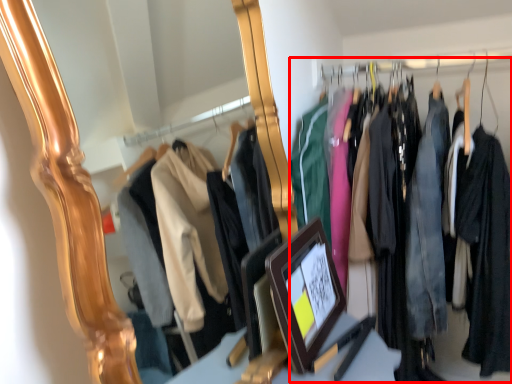
Question: From the image's perspective, where is closet (annotated by the red box) located relative to picture frame?

Choices:
 (A) below
 (B) above

Answer: (B)